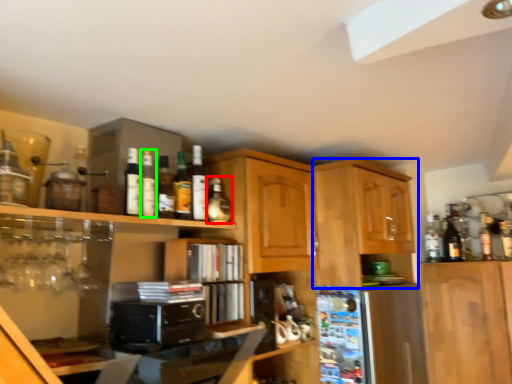
Question: Which object is positioned closest to bottle (highlighted by a red box)? Select from cabinetry (highlighted by a blue box) and bottle (highlighted by a green box).

Choices:
 (A) cabinetry
 (B) bottle

Answer: (B)